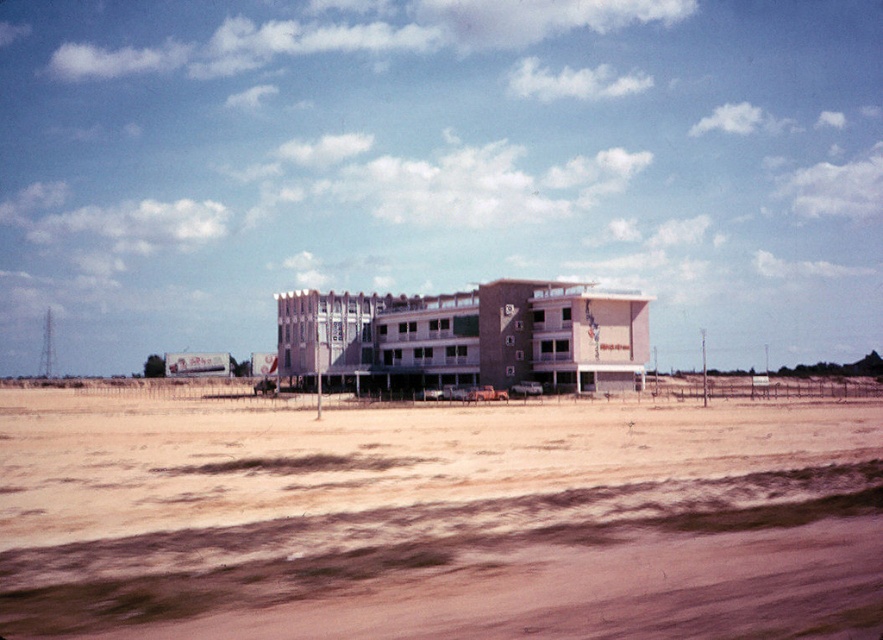
Is brown sandy dirt field at lower center below beige brick hotel at center?

Indeed, brown sandy dirt field at lower center is positioned under beige brick hotel at center.

Can you confirm if brown sandy dirt field at lower center is taller than beige brick hotel at center?

In fact, brown sandy dirt field at lower center may be shorter than beige brick hotel at center.

The height and width of the screenshot is (640, 883). Find the location of `brown sandy dirt field at lower center`. brown sandy dirt field at lower center is located at coordinates (436, 518).